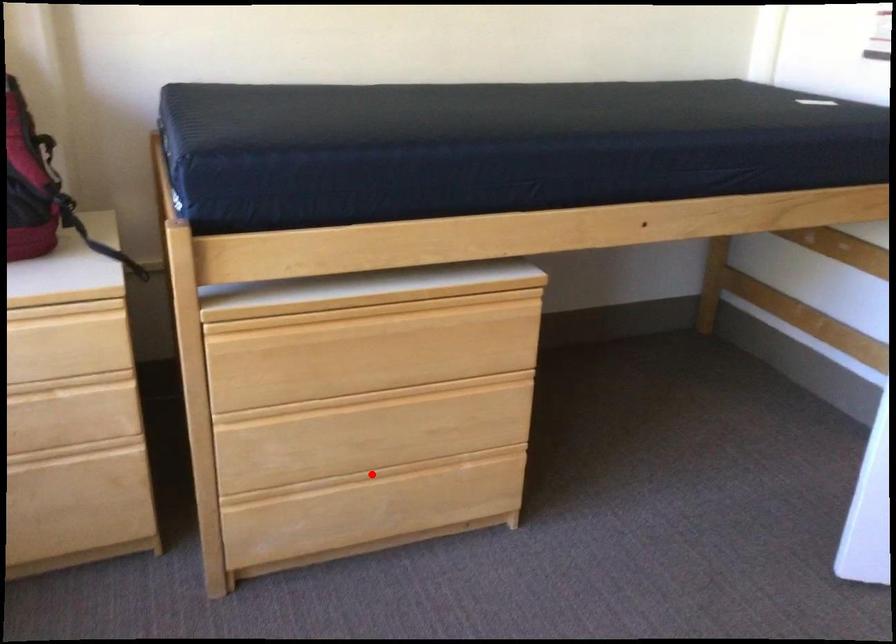
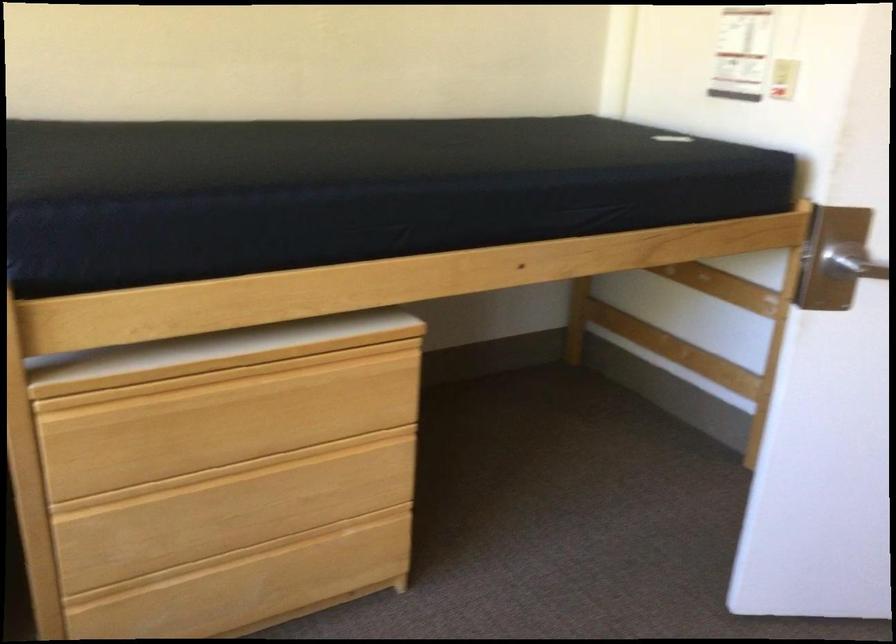
Where in the second image is the point corresponding to the highlighted location from the first image?

(238, 558)